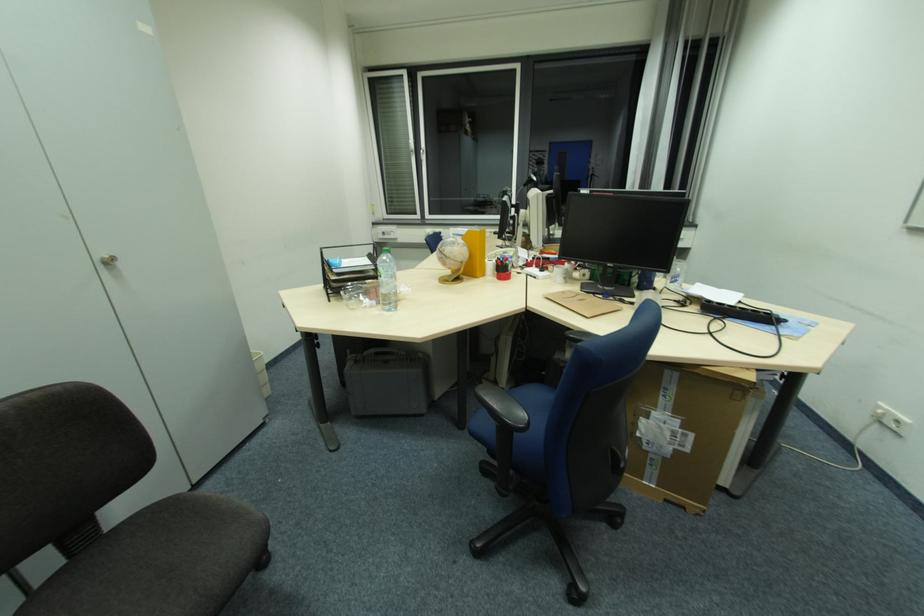
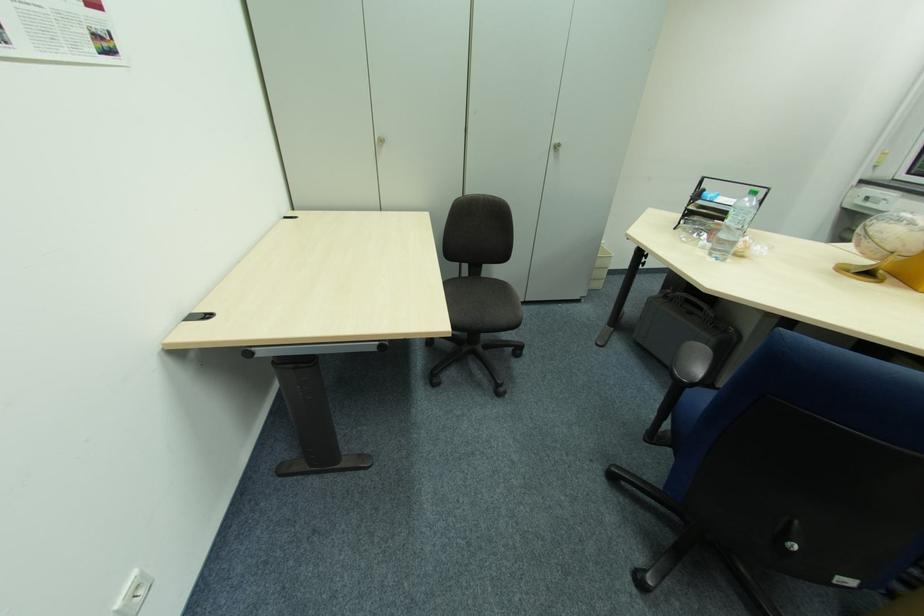
Locate, in the second image, the point that corresponds to point 117,530 in the first image.

(485, 278)